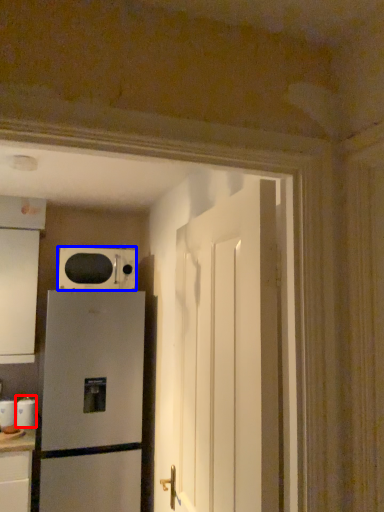
Question: Which point is closer to the camera, appliance (highlighted by a red box) or microwave oven (highlighted by a blue box)?

Choices:
 (A) appliance
 (B) microwave oven

Answer: (B)